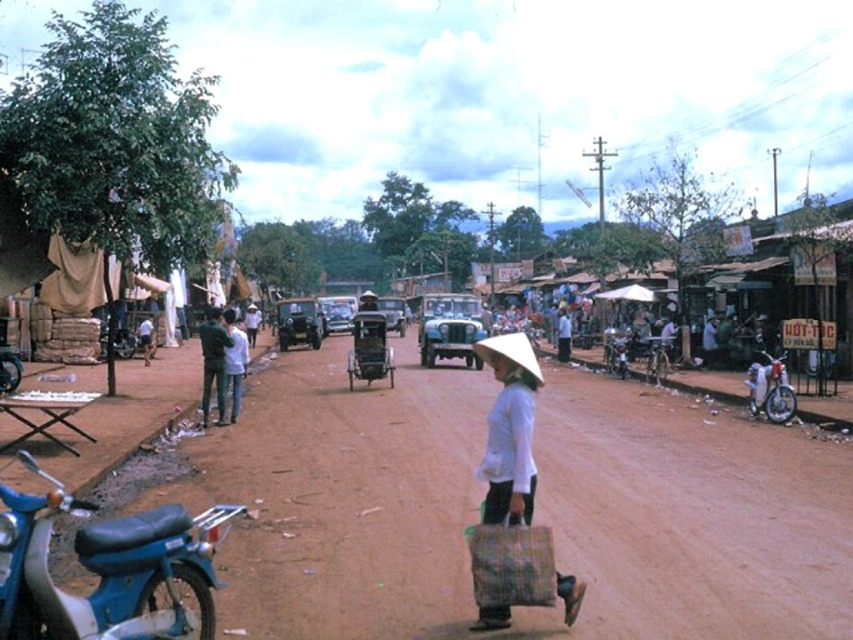
Does dark green fabric jacket at center appear on the right side of white cotton shirt at center?

In fact, dark green fabric jacket at center is to the left of white cotton shirt at center.

Can you confirm if dark green fabric jacket at center is positioned below white cotton shirt at center?

Actually, dark green fabric jacket at center is above white cotton shirt at center.

Which is in front, point (207, 360) or point (233, 326)?

Point (207, 360) is in front.

This screenshot has width=853, height=640. What are the coordinates of `dark green fabric jacket at center` in the screenshot? It's located at 213,362.

Is white fabric hat at center bigger than light blue jeans at center?

No.

Who is higher up, white fabric hat at center or light blue jeans at center?

light blue jeans at center

Describe the element at coordinates (563, 336) in the screenshot. I see `white fabric hat at center` at that location.

At what (x,y) coordinates should I click in order to perform the action: click on white fabric hat at center. Please return your answer as a coordinate pair (x, y). Looking at the image, I should click on (563, 336).

From the picture: Can you confirm if blue matte motorbike at lower left is taller than wooden cart at center?

In fact, blue matte motorbike at lower left may be shorter than wooden cart at center.

In the scene shown: Who is lower down, blue matte motorbike at lower left or wooden cart at center?

blue matte motorbike at lower left

Who is more forward, (x=38, y=621) or (x=357, y=378)?

Point (x=38, y=621)

Find the location of `blue matte motorbike at lower left`. blue matte motorbike at lower left is located at coordinates (105, 568).